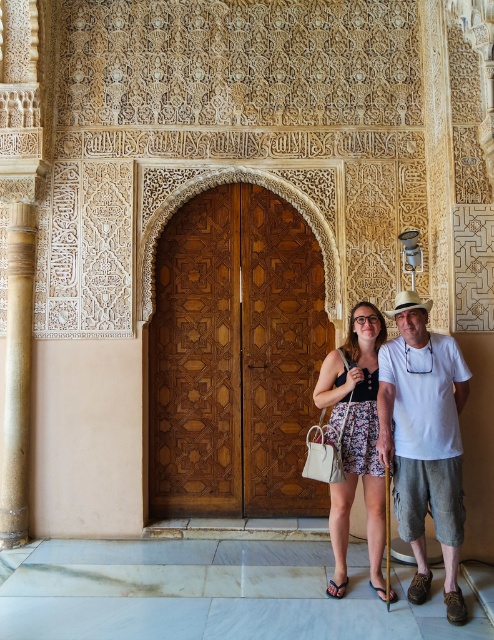
Question: Does floral fabric dress at center have a larger size compared to blue fabric sandal at lower center?

Choices:
 (A) yes
 (B) no

Answer: (A)

Question: Where is wooden carved door at center located in relation to blue fabric sandal at lower center in the image?

Choices:
 (A) right
 (B) left

Answer: (B)

Question: Which point is farther to the camera?

Choices:
 (A) (373, 589)
 (B) (0, 513)
 (C) (336, 595)

Answer: (B)

Question: Which object is farther from the camera taking this photo?

Choices:
 (A) brown leather sandal at lower center
 (B) wooden carved door at center

Answer: (B)

Question: Which of these objects is positioned closest to the floral fabric dress at center?

Choices:
 (A) wooden carved door at center
 (B) brown leather sandal at lower center
 (C) smooth brown column at left
 (D) white cotton shirt at center

Answer: (D)

Question: Does smooth brown column at left have a larger size compared to blue fabric sandal at lower center?

Choices:
 (A) no
 (B) yes

Answer: (B)